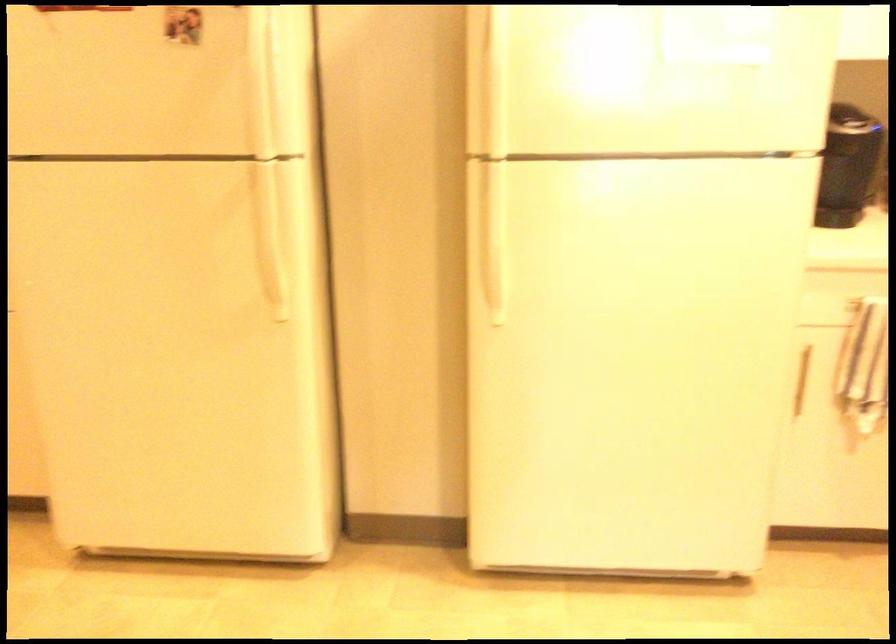
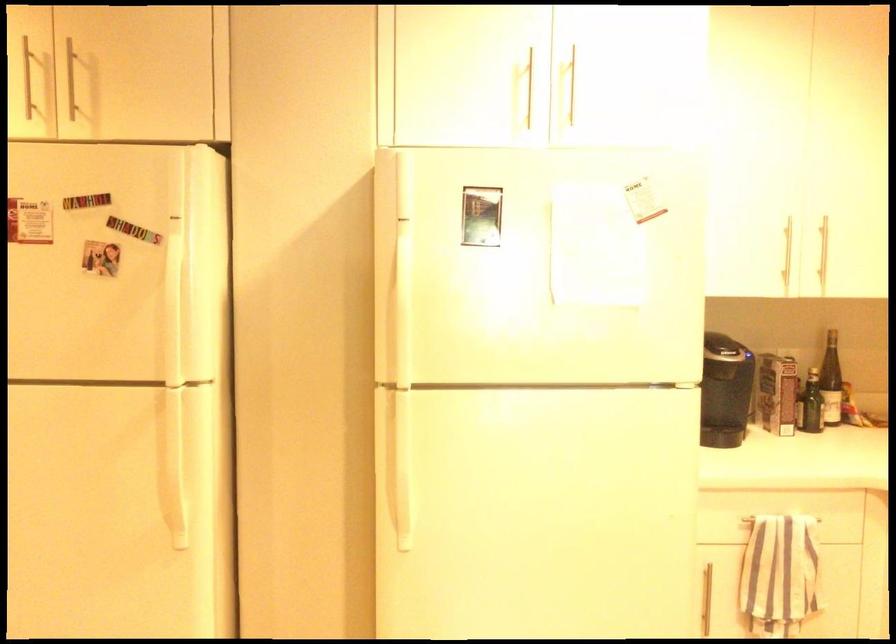
Where in the second image is the point corresponding to the point at 269,225 from the first image?

(170, 453)